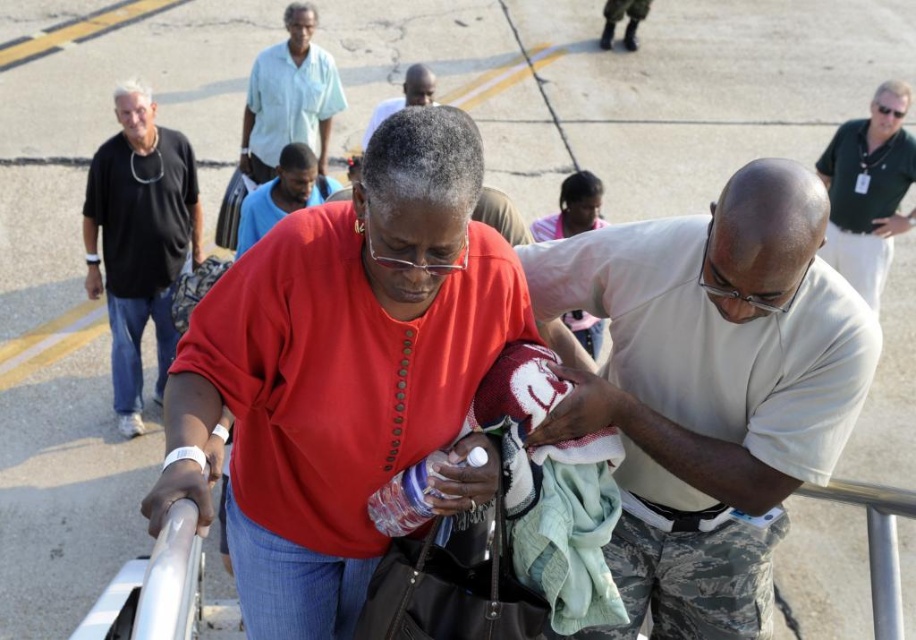
Is white uniform at center positioned at the back of green shirt at upper right?

No, it is in front of green shirt at upper right.

Does white uniform at center have a greater height compared to green shirt at upper right?

In fact, white uniform at center may be shorter than green shirt at upper right.

Between point (688, 292) and point (852, 182), which one is positioned behind?

Point (852, 182)

This screenshot has height=640, width=916. I want to click on white uniform at center, so click(x=707, y=388).

Is point (134, 118) farther from camera compared to point (322, 148)?

No, it is in front of (322, 148).

Between black matte shirt at left and light blue cotton shirt at upper center, which one is positioned higher?

Positioned higher is light blue cotton shirt at upper center.

This screenshot has height=640, width=916. Describe the element at coordinates (139, 241) in the screenshot. I see `black matte shirt at left` at that location.

The width and height of the screenshot is (916, 640). I want to click on black matte shirt at left, so click(x=139, y=241).

Does black matte shirt at left have a lesser width compared to blue cotton shirt at center?

Yes, black matte shirt at left is thinner than blue cotton shirt at center.

Is black matte shirt at left above blue cotton shirt at center?

No, black matte shirt at left is not above blue cotton shirt at center.

I want to click on black matte shirt at left, so click(x=139, y=241).

The height and width of the screenshot is (640, 916). I want to click on black matte shirt at left, so click(x=139, y=241).